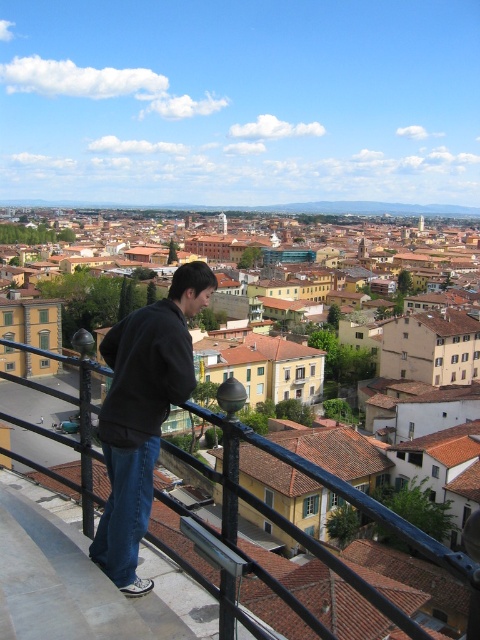
Question: Does dark gray hoodie at center have a greater width compared to denim at left?

Choices:
 (A) no
 (B) yes

Answer: (B)

Question: Among these objects, which one is farthest from the camera?

Choices:
 (A) dark gray hoodie at center
 (B) denim at left
 (C) black metal/rail at upper center

Answer: (A)

Question: Which object is closer to the camera taking this photo?

Choices:
 (A) denim at left
 (B) dark gray hoodie at center
 (C) black metal/rail at upper center

Answer: (C)

Question: Is dark gray hoodie at center above black metal/rail at upper center?

Choices:
 (A) no
 (B) yes

Answer: (B)

Question: Is black metal/rail at upper center further to the viewer compared to denim at left?

Choices:
 (A) yes
 (B) no

Answer: (B)

Question: Which of the following is the closest to the observer?

Choices:
 (A) (171, 444)
 (B) (93, 541)
 (C) (106, 548)

Answer: (C)